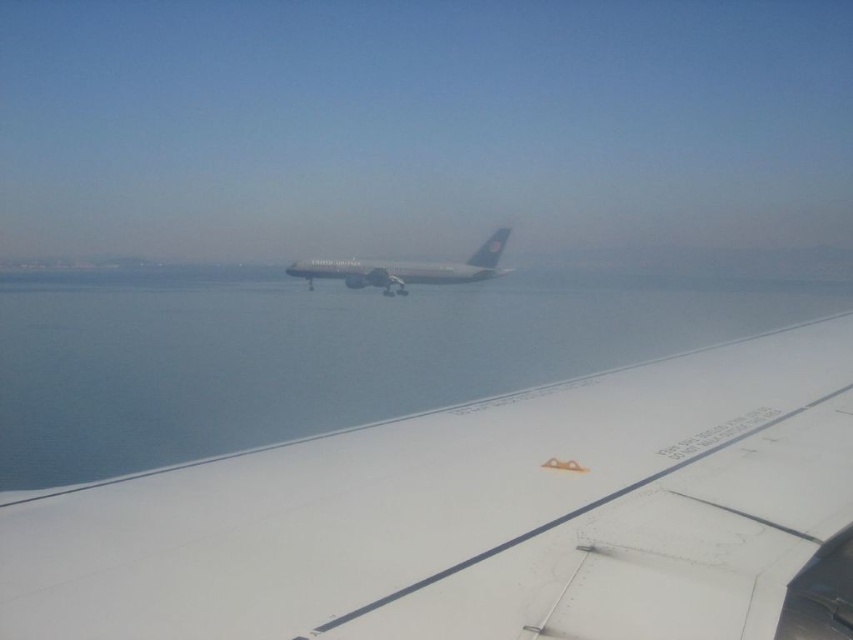
Question: Which point is farther to the camera?

Choices:
 (A) (334, 269)
 (B) (846, 392)
 (C) (212, 358)
 (D) (436, 284)

Answer: (A)

Question: Does blue water at center appear under white glossy airplane wing at center?

Choices:
 (A) no
 (B) yes

Answer: (B)

Question: Does white matte wing at center appear on the left side of silver metallic airplane at center?

Choices:
 (A) yes
 (B) no

Answer: (B)

Question: Which object is farther from the camera taking this photo?

Choices:
 (A) blue water at center
 (B) white glossy airplane wing at center
 (C) white matte wing at center

Answer: (B)

Question: Which of the following is the closest to the observer?

Choices:
 (A) white glossy airplane wing at center
 (B) white matte wing at center
 (C) silver metallic airplane at center

Answer: (B)

Question: Can you confirm if silver metallic airplane at center is positioned to the right of white glossy airplane wing at center?

Choices:
 (A) yes
 (B) no

Answer: (A)